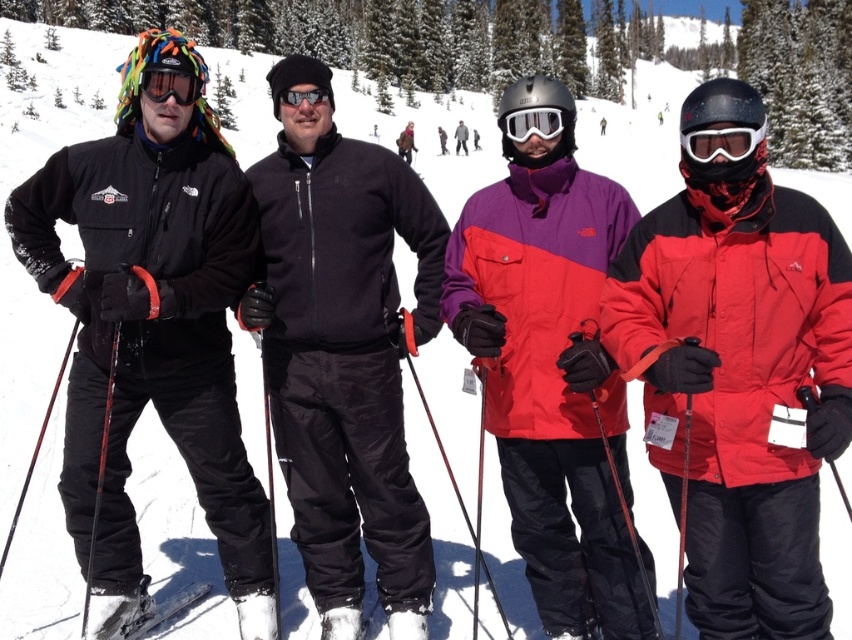
You are a photographer taking a group photo of the four skiers. You need to adjust the lighting to ensure both the glossy plastic goggles at center and the matte black goggles at left are clearly visible. Which goggles are positioned lower in the frame?

The glossy plastic goggles at center is positioned lower than the matte black goggles at left, so you should adjust the lighting to account for its lower placement to ensure visibility.

You are a photographer trying to frame a shot of the glossy plastic goggles at center and the matte black goggles at left. If you want to capture both in a single photo without cropping, which pair of goggles should you focus on to ensure they appear proportionally sized in the frame?

The glossy plastic goggles at center has a larger width than the matte black goggles at left. To ensure they appear proportionally sized in the frame, focus on the glossy plastic goggles at center and position it slightly farther back, while keeping the matte black goggles at left closer to the camera. This way, the larger goggles will be smaller in the frame, balancing their sizes visually.